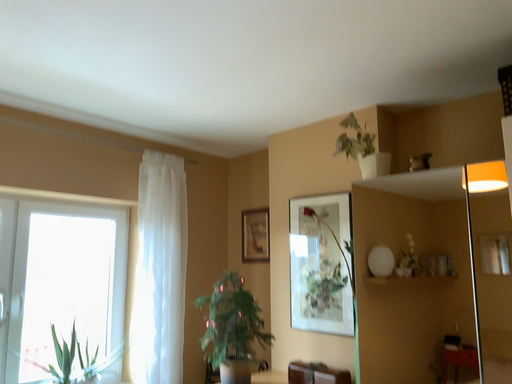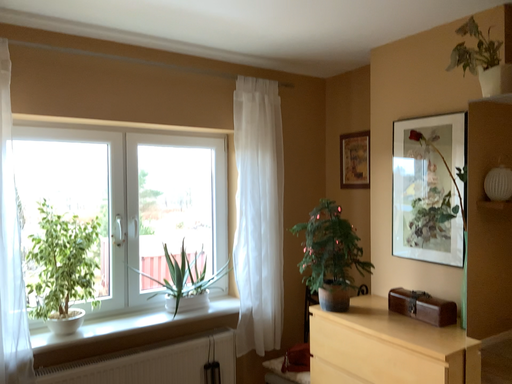
Question: How did the camera likely rotate when shooting the video?

Choices:
 (A) rotated right
 (B) rotated left

Answer: (B)